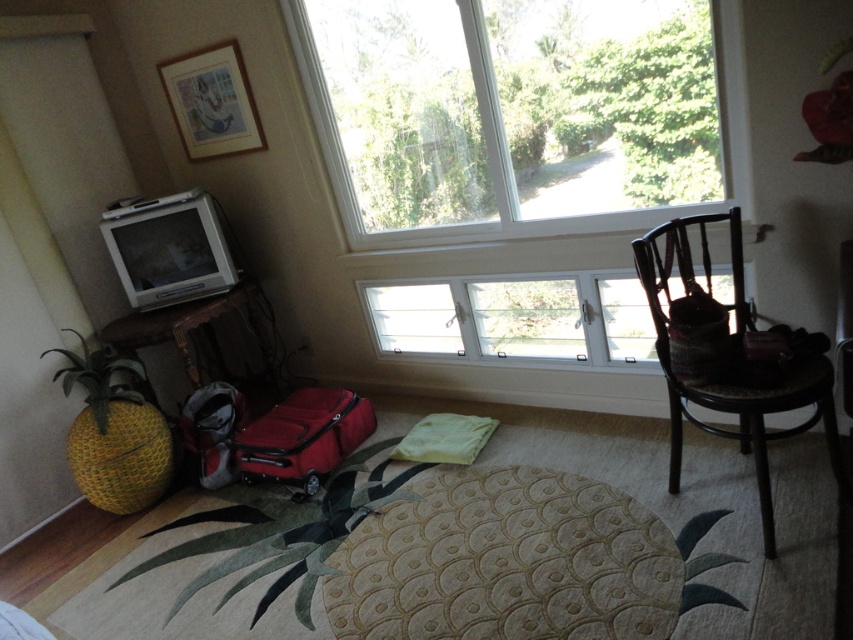
You are planning to hang a picture frame that is 1 meter tall on the wall. The frame must be placed above the clear glass window at upper center but below the dark brown woven chair at right. Is there enough vertical space between these two objects to fit the frame?

The clear glass window at upper center is shorter than the dark brown woven chair at right. However, without knowing the exact distance between them, it is impossible to determine if there is enough vertical space for the 1 meter tall picture frame.

You are moving into this room and need to place a new lamp between the dark brown woven chair at right and the matte red suitcase at center. Based on their current positions, which object should the lamp be closer to?

The dark brown woven chair at right is positioned on the right side of the matte red suitcase at center, so the lamp should be placed closer to the dark brown woven chair at right to maintain symmetry between the two objects.